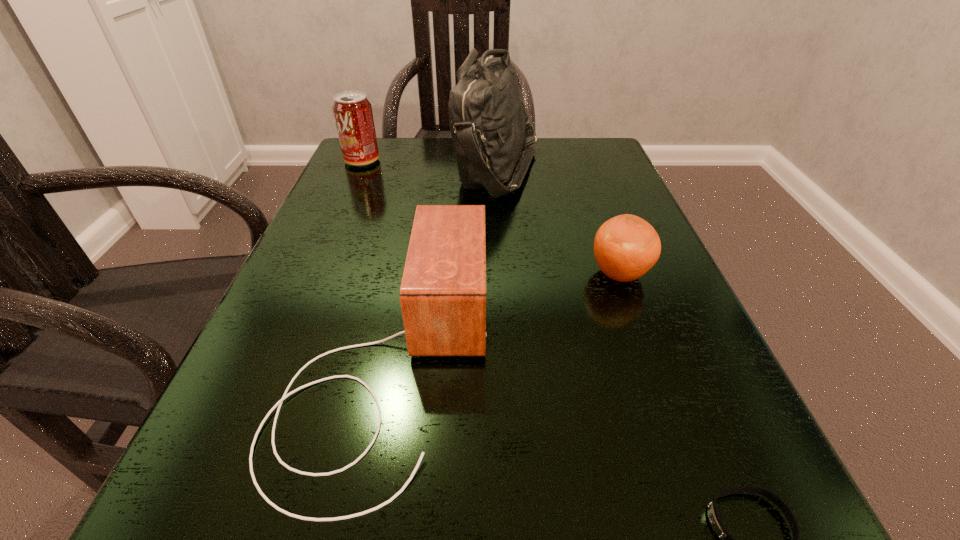
The image size is (960, 540). Find the location of `shoulder bag that is at the far edge`. shoulder bag that is at the far edge is located at coordinates tap(490, 126).

This screenshot has height=540, width=960. I want to click on soda can present at the far edge, so click(353, 115).

At what (x,y) coordinates should I click in order to perform the action: click on object located in the near edge section of the desktop. Please return your answer as a coordinate pair (x, y). Looking at the image, I should click on (443, 291).

Image resolution: width=960 pixels, height=540 pixels. In order to click on soda can situated at the left edge in this screenshot , I will do `click(353, 115)`.

The width and height of the screenshot is (960, 540). In order to click on radio receiver that is at the left edge in this screenshot , I will do 443,291.

Find the location of a particular element. The width and height of the screenshot is (960, 540). object present at the right edge is located at coordinates (625, 247).

I want to click on object that is positioned at the far left corner, so click(x=353, y=115).

You are a GUI agent. You are given a task and a screenshot of the screen. Output one action in this format:
    pyautogui.click(x=<x>, y=<y>)
    Task: Click on the object present at the near left corner
    Image resolution: width=960 pixels, height=540 pixels.
    Given the screenshot: What is the action you would take?
    pyautogui.click(x=443, y=291)

Locate an element on the screen. vacant region at the far edge of the desktop is located at coordinates (x=426, y=166).

In the image, there is a desktop. Find the location of `vacant space at the near edge`. vacant space at the near edge is located at coordinates (465, 496).